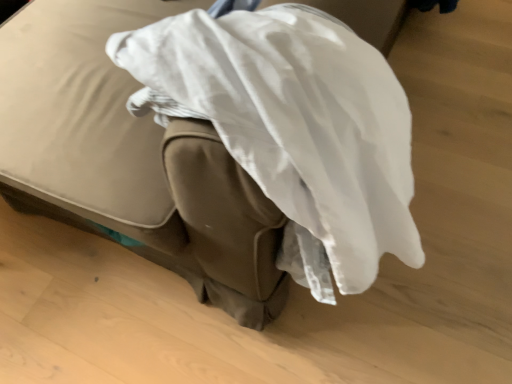
Image resolution: width=512 pixels, height=384 pixels. In order to click on satin fabric bag at center in this screenshot , I will do `click(216, 140)`.

Describe the element at coordinates (216, 140) in the screenshot. This screenshot has width=512, height=384. I see `satin fabric bag at center` at that location.

I want to click on satin fabric bag at center, so click(216, 140).